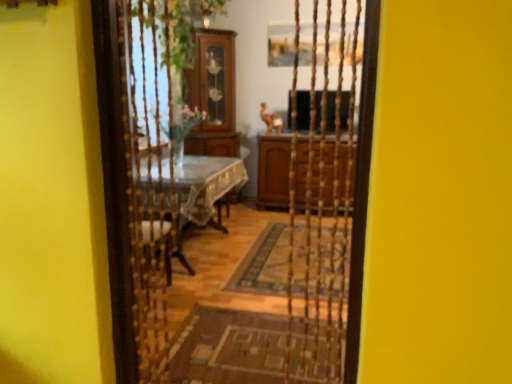
The height and width of the screenshot is (384, 512). What do you see at coordinates (229, 347) in the screenshot? I see `brown woven mat at center` at bounding box center [229, 347].

In order to face brown woven mat at center, should I rotate leftwards or rightwards?

You should look left and rotate roughly 0.987 degrees.

Identify the location of brown woven mat at center. Image resolution: width=512 pixels, height=384 pixels. (229, 347).

What is the approximate height of brown woven mat at center?

The height of brown woven mat at center is 2.38 inches.

Image resolution: width=512 pixels, height=384 pixels. Describe the element at coordinates (273, 171) in the screenshot. I see `brown wood cabinet at center` at that location.

Where is `brown wood cabinet at center`? The image size is (512, 384). brown wood cabinet at center is located at coordinates (273, 171).

Locate an element on the screen. brown woven mat at center is located at coordinates (229, 347).

Considering the positions of objects brown woven mat at center and brown wood cabinet at center in the image provided, who is more to the right, brown woven mat at center or brown wood cabinet at center?

From the viewer's perspective, brown wood cabinet at center appears more on the right side.

Considering the positions of objects brown woven mat at center and brown wood cabinet at center in the image provided, who is in front, brown woven mat at center or brown wood cabinet at center?

brown woven mat at center is in front.

Which is closer to the camera, (271, 324) or (273, 175)?

Positioned in front is point (271, 324).

From the image's perspective, who appears lower, brown woven mat at center or brown wood cabinet at center?

From the image's view, brown woven mat at center is below.

From a real-world perspective, is brown woven mat at center positioned under brown wood cabinet at center based on gravity?

Yes, from a real-world perspective, brown woven mat at center is below brown wood cabinet at center.

Does brown woven mat at center have a lesser width compared to brown wood cabinet at center?

In fact, brown woven mat at center might be wider than brown wood cabinet at center.

Which of these two, brown woven mat at center or brown wood cabinet at center, stands shorter?

With less height is brown woven mat at center.

Between brown woven mat at center and brown wood cabinet at center, which one has larger size?

With larger size is brown wood cabinet at center.

Is brown woven mat at center surrounding brown wood cabinet at center?

That's incorrect, brown wood cabinet at center is not inside brown woven mat at center.

Looking at this image, would you consider brown woven mat at center to be distant from brown wood cabinet at center?

That's right, there is a large distance between brown woven mat at center and brown wood cabinet at center.

Is brown woven mat at center oriented towards brown wood cabinet at center?

Yes, brown woven mat at center is aimed at brown wood cabinet at center.

How many degrees apart are the facing directions of brown woven mat at center and brown wood cabinet at center?

The facing directions of brown woven mat at center and brown wood cabinet at center are 179 degrees apart.

At what (x,y) coordinates should I click in order to perform the action: click on doormat on the left side of brown wood cabinet at center. Please return your answer as a coordinate pair (x, y). The height and width of the screenshot is (384, 512). Looking at the image, I should click on (229, 347).

Based on the photo, does brown wood cabinet at center appear on the right side of brown woven mat at center?

Correct, you'll find brown wood cabinet at center to the right of brown woven mat at center.

Is brown wood cabinet at center further to camera compared to brown woven mat at center?

That is True.

Between point (353, 183) and point (204, 313), which one is positioned behind?

The point (353, 183) is farther from the camera.

From the image's perspective, is brown wood cabinet at center located above or below brown woven mat at center?

Based on their image positions, brown wood cabinet at center is located above brown woven mat at center.

From a real-world perspective, which is physically below, brown wood cabinet at center or brown woven mat at center?

brown woven mat at center, from a real-world perspective.

Looking at their sizes, would you say brown wood cabinet at center is wider or thinner than brown woven mat at center?

In the image, brown wood cabinet at center appears to be more narrow than brown woven mat at center.

Between brown wood cabinet at center and brown woven mat at center, which one has more height?

With more height is brown wood cabinet at center.

Who is bigger, brown wood cabinet at center or brown woven mat at center?

Bigger between the two is brown wood cabinet at center.

Is brown wood cabinet at center inside the boundaries of brown woven mat at center, or outside?

brown wood cabinet at center is located beyond the bounds of brown woven mat at center.

Are brown wood cabinet at center and brown woven mat at center beside each other?

No, brown wood cabinet at center is not touching brown woven mat at center.

Is brown wood cabinet at center aimed at brown woven mat at center?

Yes, brown wood cabinet at center is aimed at brown woven mat at center.

This screenshot has height=384, width=512. I want to click on cabinetry above the brown woven mat at center (from a real-world perspective), so click(x=273, y=171).

Locate an element on the screen. doormat in front of the brown wood cabinet at center is located at coordinates (229, 347).

Find the location of a particular element. cabinetry above the brown woven mat at center (from a real-world perspective) is located at coordinates (273, 171).